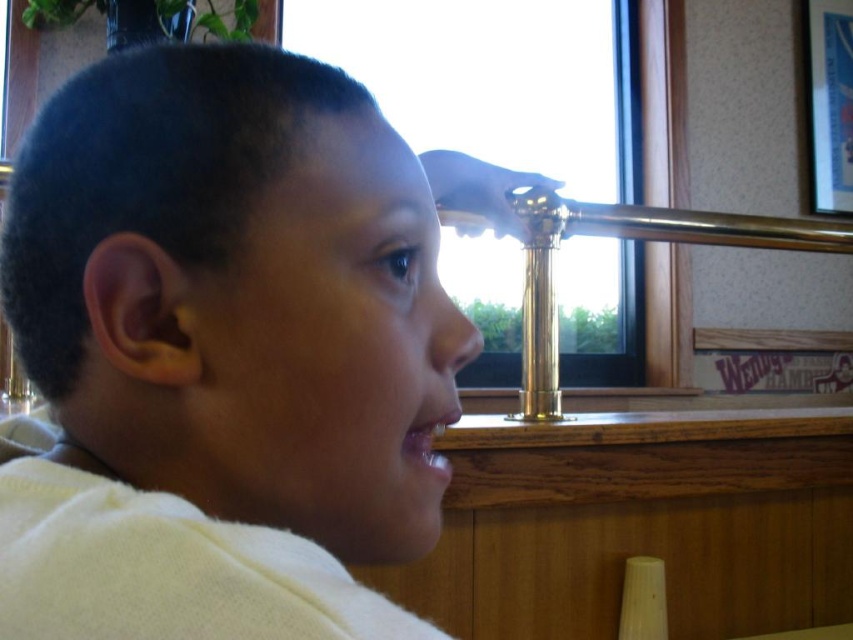
Question: Is the position of white matte shirt at center more distant than that of transparent glass window at center?

Choices:
 (A) no
 (B) yes

Answer: (A)

Question: In this image, where is white matte shirt at center located relative to transparent glass window at center?

Choices:
 (A) right
 (B) left

Answer: (B)

Question: Which object is farther from the camera taking this photo?

Choices:
 (A) transparent glass window at center
 (B) white matte shirt at center

Answer: (A)

Question: Is white matte shirt at center smaller than transparent glass window at center?

Choices:
 (A) no
 (B) yes

Answer: (B)

Question: Which point is farther to the camera?

Choices:
 (A) (164, 259)
 (B) (509, 244)

Answer: (B)

Question: Which object appears closest to the camera in this image?

Choices:
 (A) transparent glass window at center
 (B) white matte shirt at center

Answer: (B)